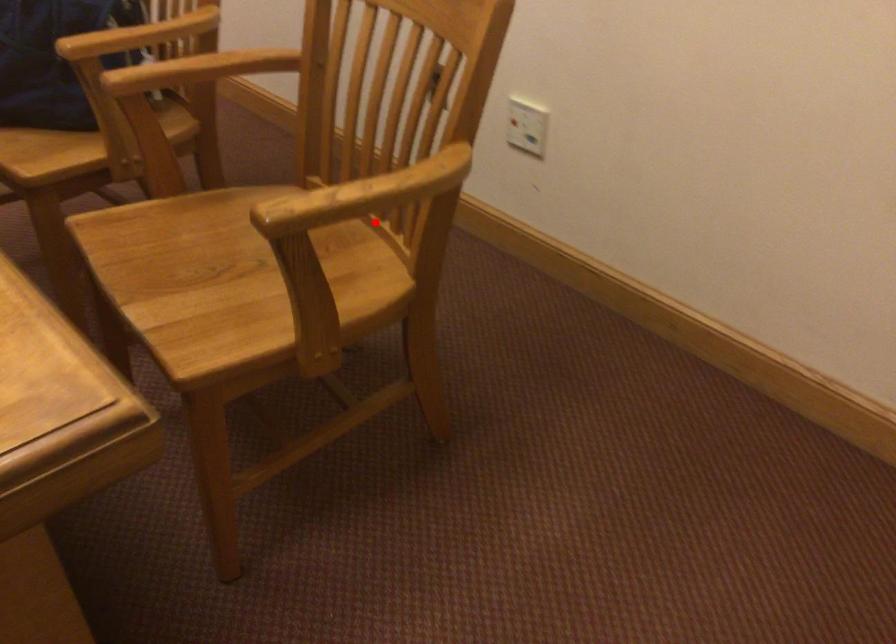
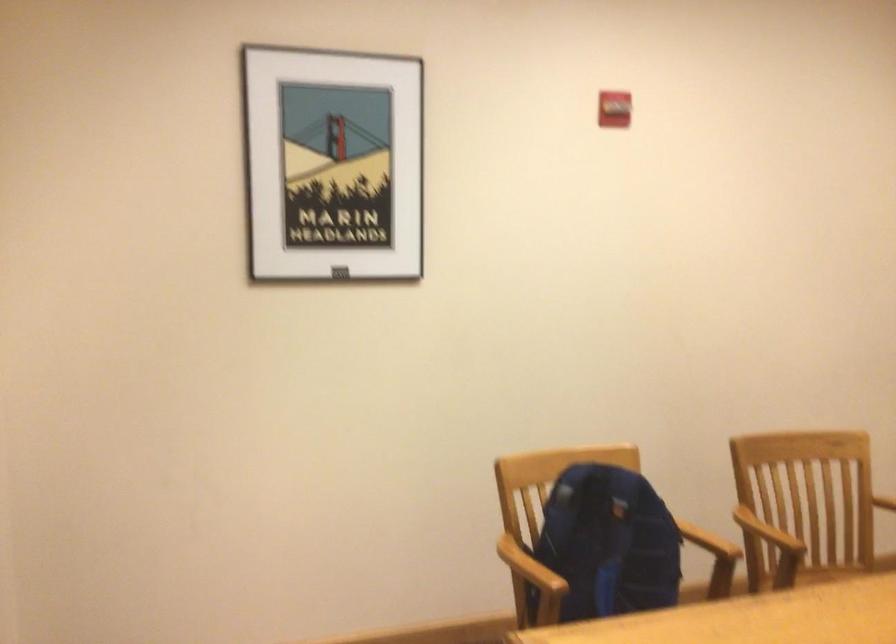
The point at the highlighted location is marked in the first image. Where is the corresponding point in the second image?

(837, 572)